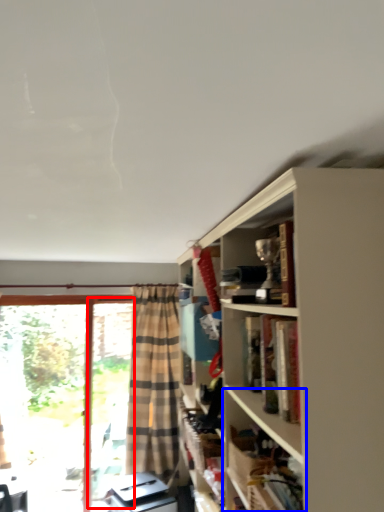
Question: Which of the following is the closest to the observer, screen door (highlighted by a red box) or shelf (highlighted by a blue box)?

Choices:
 (A) screen door
 (B) shelf

Answer: (B)